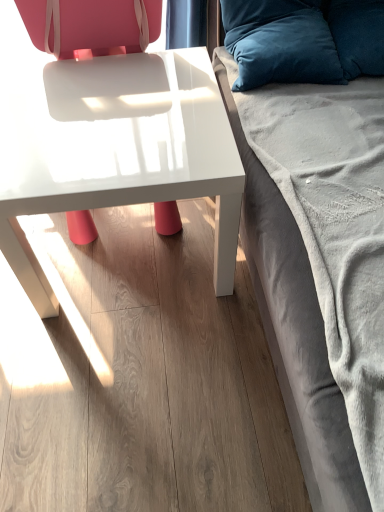
Question: Could velvet gray studio couch at right be considered to be inside velvety blue pillow at upper right, which is the 2th pillow from right to left?

Choices:
 (A) yes
 (B) no

Answer: (B)

Question: Is velvety blue pillow at upper right, which is the 2th pillow from right to left, shorter than velvet gray studio couch at right?

Choices:
 (A) no
 (B) yes

Answer: (B)

Question: Is velvety blue pillow at upper right, the first pillow positioned from the left, facing towards velvet gray studio couch at right?

Choices:
 (A) no
 (B) yes

Answer: (B)

Question: From a real-world perspective, is velvety blue pillow at upper right, which is the 2th pillow from right to left, physically above velvet gray studio couch at right?

Choices:
 (A) no
 (B) yes

Answer: (B)

Question: Is velvety blue pillow at upper right, the first pillow positioned from the left, to the left of velvet gray studio couch at right from the viewer's perspective?

Choices:
 (A) no
 (B) yes

Answer: (B)

Question: Can you confirm if velvety blue pillow at upper right, the first pillow positioned from the left, is taller than velvet gray studio couch at right?

Choices:
 (A) yes
 (B) no

Answer: (B)

Question: Is velvety blue pillow at upper right, acting as the 1th pillow starting from the right, a part of matte white chair at center?

Choices:
 (A) no
 (B) yes

Answer: (A)

Question: Considering the relative sizes of matte white chair at center and velvety blue pillow at upper right, the 2th pillow when ordered from left to right, in the image provided, is matte white chair at center taller than velvety blue pillow at upper right, the 2th pillow when ordered from left to right,?

Choices:
 (A) yes
 (B) no

Answer: (A)

Question: Can you confirm if matte white chair at center is wider than velvety blue pillow at upper right, the 2th pillow when ordered from left to right?

Choices:
 (A) no
 (B) yes

Answer: (A)

Question: Does matte white chair at center appear on the right side of velvety blue pillow at upper right, acting as the 1th pillow starting from the right?

Choices:
 (A) no
 (B) yes

Answer: (A)

Question: Is matte white chair at center completely or partially outside of velvety blue pillow at upper right, the 2th pillow when ordered from left to right?

Choices:
 (A) no
 (B) yes

Answer: (B)

Question: Does matte white chair at center lie behind velvety blue pillow at upper right, acting as the 1th pillow starting from the right?

Choices:
 (A) yes
 (B) no

Answer: (B)

Question: Is velvety blue pillow at upper right, acting as the 1th pillow starting from the right, bigger than velvet gray studio couch at right?

Choices:
 (A) yes
 (B) no

Answer: (B)